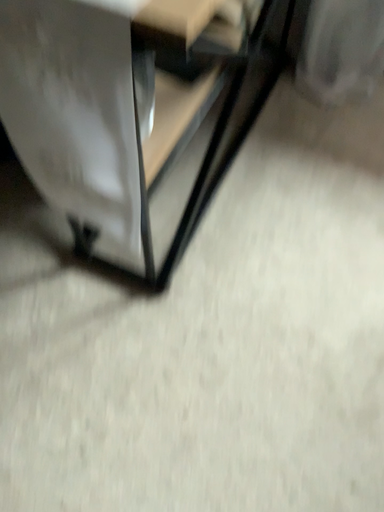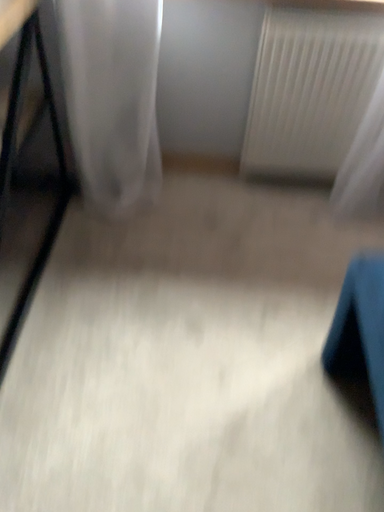
Question: How did the camera likely rotate when shooting the video?

Choices:
 (A) rotated right
 (B) rotated left

Answer: (A)